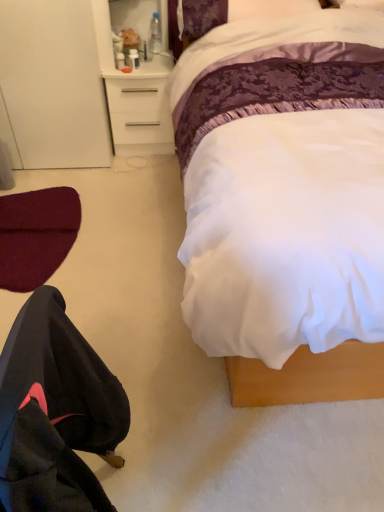
Question: From a real-world perspective, is white satin bed at center physically above maroon fabric swivel chair at lower left?

Choices:
 (A) yes
 (B) no

Answer: (A)

Question: From the image's perspective, is white satin bed at center located above maroon fabric swivel chair at lower left?

Choices:
 (A) no
 (B) yes

Answer: (B)

Question: Does white satin bed at center appear on the right side of maroon fabric swivel chair at lower left?

Choices:
 (A) no
 (B) yes

Answer: (B)

Question: Does white satin bed at center turn towards maroon fabric swivel chair at lower left?

Choices:
 (A) no
 (B) yes

Answer: (A)

Question: Is white satin bed at center positioned behind maroon fabric swivel chair at lower left?

Choices:
 (A) yes
 (B) no

Answer: (B)

Question: Is white satin bed at center surrounding maroon fabric swivel chair at lower left?

Choices:
 (A) no
 (B) yes

Answer: (A)

Question: Does maroon fabric swivel chair at lower left appear on the right side of black fabric robe at lower left?

Choices:
 (A) no
 (B) yes

Answer: (A)

Question: Does maroon fabric swivel chair at lower left have a lesser width compared to black fabric robe at lower left?

Choices:
 (A) no
 (B) yes

Answer: (A)

Question: Is maroon fabric swivel chair at lower left wider than black fabric robe at lower left?

Choices:
 (A) no
 (B) yes

Answer: (B)

Question: Can you confirm if maroon fabric swivel chair at lower left is bigger than black fabric robe at lower left?

Choices:
 (A) yes
 (B) no

Answer: (B)

Question: Considering the relative sizes of maroon fabric swivel chair at lower left and black fabric robe at lower left in the image provided, is maroon fabric swivel chair at lower left taller than black fabric robe at lower left?

Choices:
 (A) yes
 (B) no

Answer: (B)

Question: Is maroon fabric swivel chair at lower left outside black fabric robe at lower left?

Choices:
 (A) yes
 (B) no

Answer: (A)

Question: Is clear plastic bottle at upper center turned away from white satin bed at center?

Choices:
 (A) no
 (B) yes

Answer: (A)